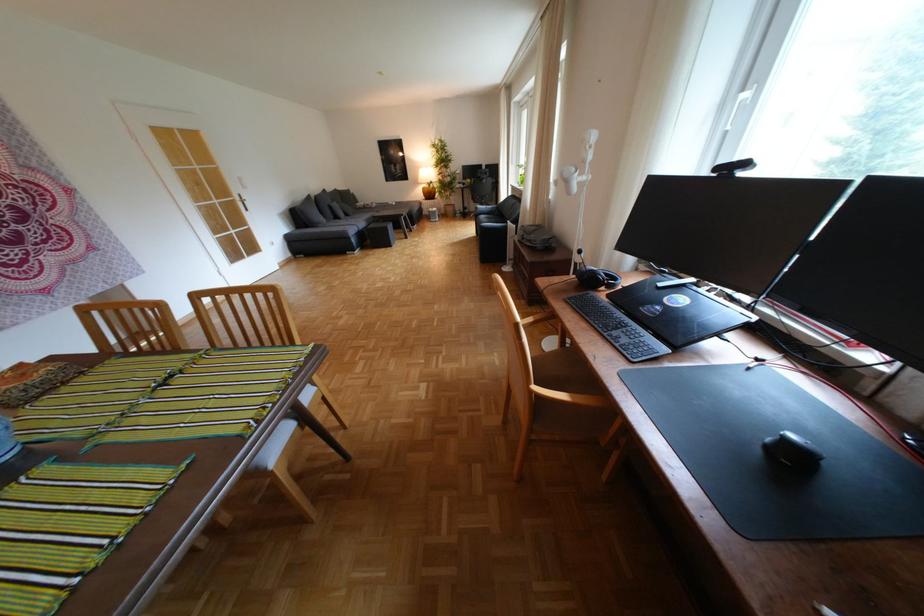
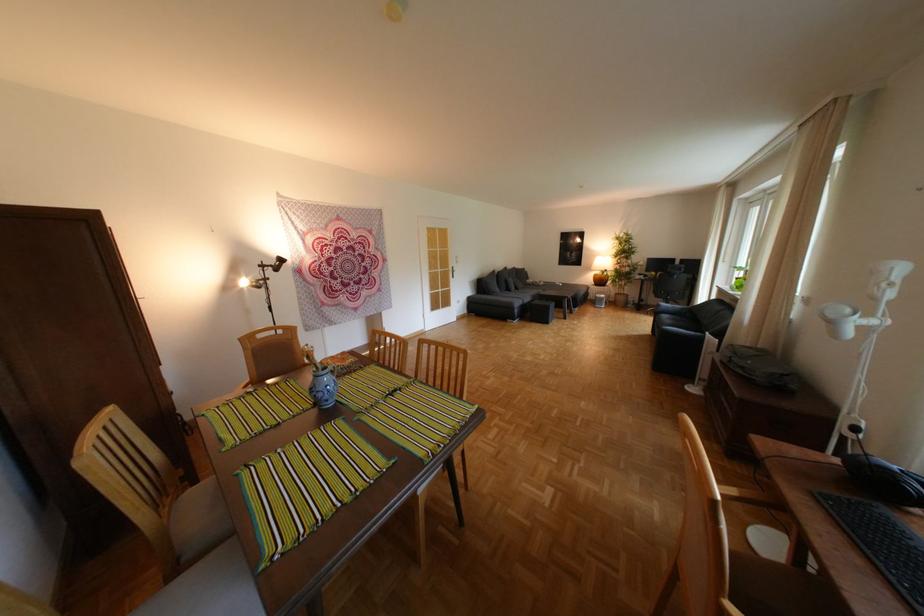
The point at (x=429, y=182) is marked in the first image. Where is the corresponding point in the second image?

(602, 268)